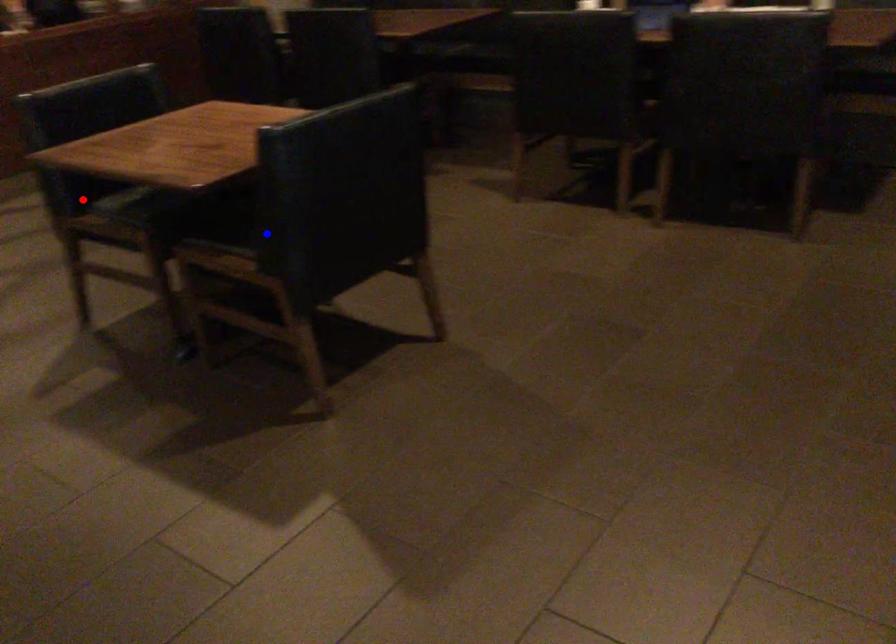
Question: Which of the two points in the image is closer to the camera?

Choices:
 (A) Blue point is closer.
 (B) Red point is closer.

Answer: (A)